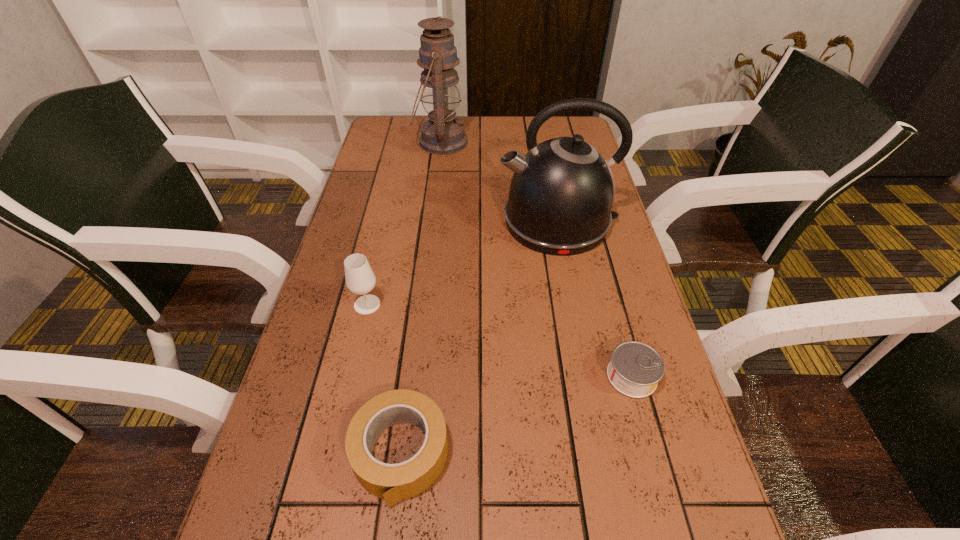
Locate an element on the screen. oil lamp is located at coordinates (x=442, y=134).

What are the coordinates of `kettle` in the screenshot? It's located at (561, 194).

Where is `the third tallest object`? The image size is (960, 540). the third tallest object is located at coordinates (360, 279).

You are a GUI agent. You are given a task and a screenshot of the screen. Output one action in this format:
    pyautogui.click(x=<x>, y=<y>)
    Task: Click on the glass
    
    Given the screenshot: What is the action you would take?
    pyautogui.click(x=360, y=279)

The image size is (960, 540). I want to click on duct tape, so click(x=392, y=482).

The width and height of the screenshot is (960, 540). In order to click on the nearest object in this screenshot , I will do `click(392, 482)`.

The image size is (960, 540). In order to click on the shortest object in this screenshot , I will do `click(635, 369)`.

What are the coordinates of `the fourth farthest object` in the screenshot? It's located at (635, 369).

I want to click on vacant space positioned 0.190m on the right of the oil lamp, so click(522, 142).

Find the location of a particular element. vacant point located on the spout of the fourth nearest object is located at coordinates (390, 221).